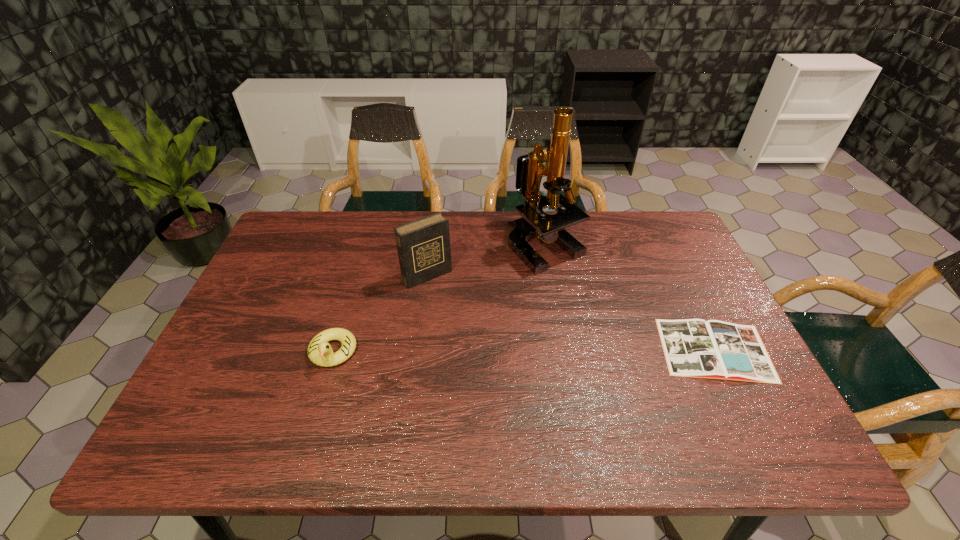
In order to click on duckling in this screenshot , I will do `click(320, 352)`.

Where is `the third tallest object`? the third tallest object is located at coordinates (320, 352).

At what (x,y) coordinates should I click in order to perform the action: click on the rightmost object. Please return your answer as a coordinate pair (x, y). The height and width of the screenshot is (540, 960). Looking at the image, I should click on (714, 349).

The width and height of the screenshot is (960, 540). Identify the location of the shortest object. (714, 349).

Locate an element on the screen. The width and height of the screenshot is (960, 540). the third object from right to left is located at coordinates (424, 251).

You are a GUI agent. You are given a task and a screenshot of the screen. Output one action in this format:
    pyautogui.click(x=<x>, y=<y>)
    Task: Click on the third shortest object
    
    Given the screenshot: What is the action you would take?
    pyautogui.click(x=424, y=251)

You are a GUI agent. You are given a task and a screenshot of the screen. Output one action in this format:
    pyautogui.click(x=<x>, y=<y>)
    Task: Click on the tallest object
    The width and height of the screenshot is (960, 540).
    Given the screenshot: What is the action you would take?
    pyautogui.click(x=534, y=223)

This screenshot has height=540, width=960. I want to click on microscope, so click(x=534, y=223).

In order to click on free space located on the back of the rightmost object in this screenshot , I will do `click(693, 306)`.

This screenshot has height=540, width=960. What are the coordinates of `free point located on the front cover of the second tallest object` in the screenshot? It's located at (497, 360).